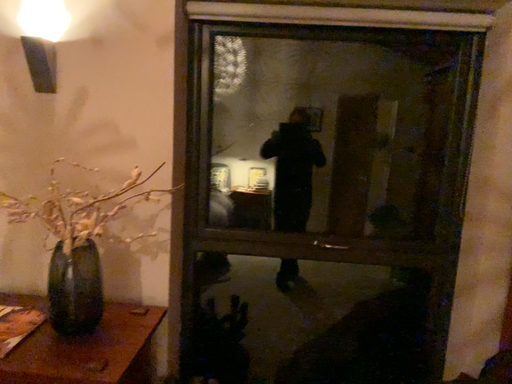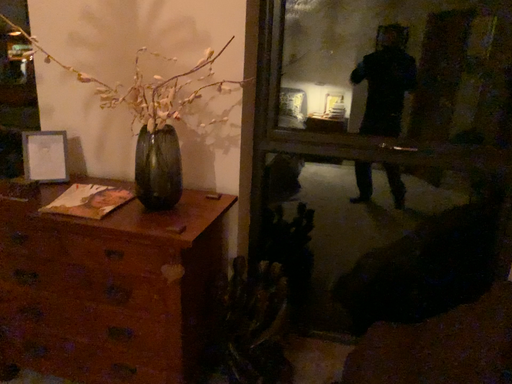
Question: How did the camera likely rotate when shooting the video?

Choices:
 (A) rotated left
 (B) rotated right

Answer: (A)